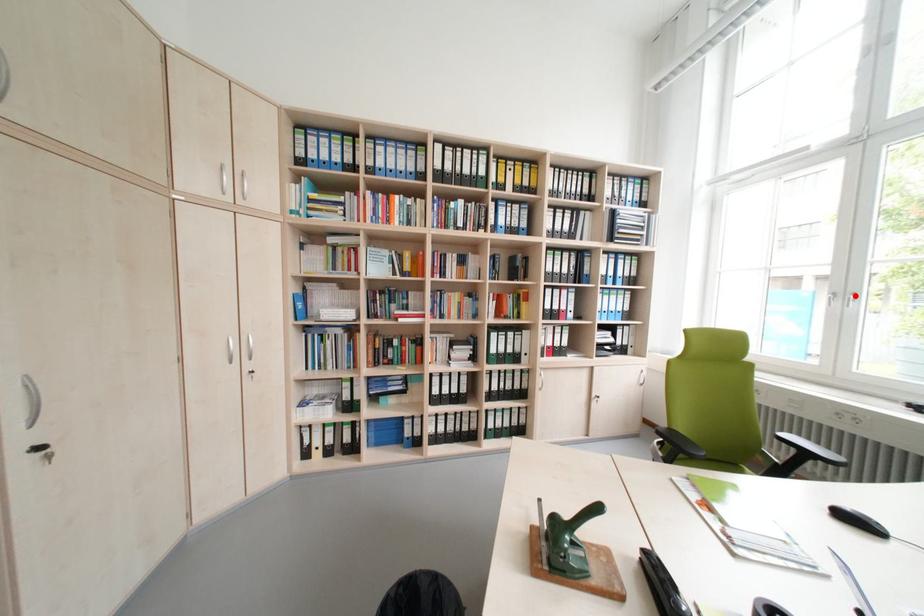
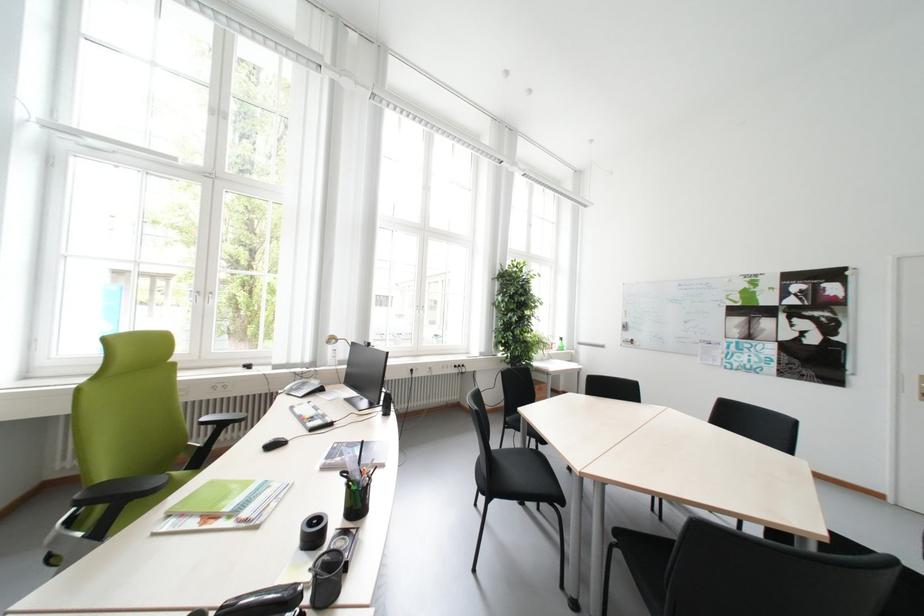
The point at the highlighted location is marked in the first image. Where is the corresponding point in the second image?

(213, 294)